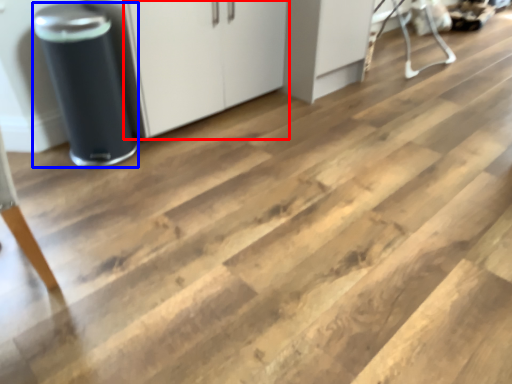
Question: Among these objects, which one is nearest to the camera, cabinetry (highlighted by a red box) or appliance (highlighted by a blue box)?

Choices:
 (A) cabinetry
 (B) appliance

Answer: (B)